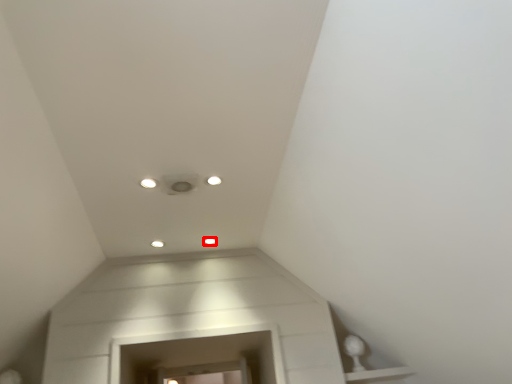
Question: Where is dot (annotated by the red box) located in relation to dot in the image?

Choices:
 (A) right
 (B) left

Answer: (A)